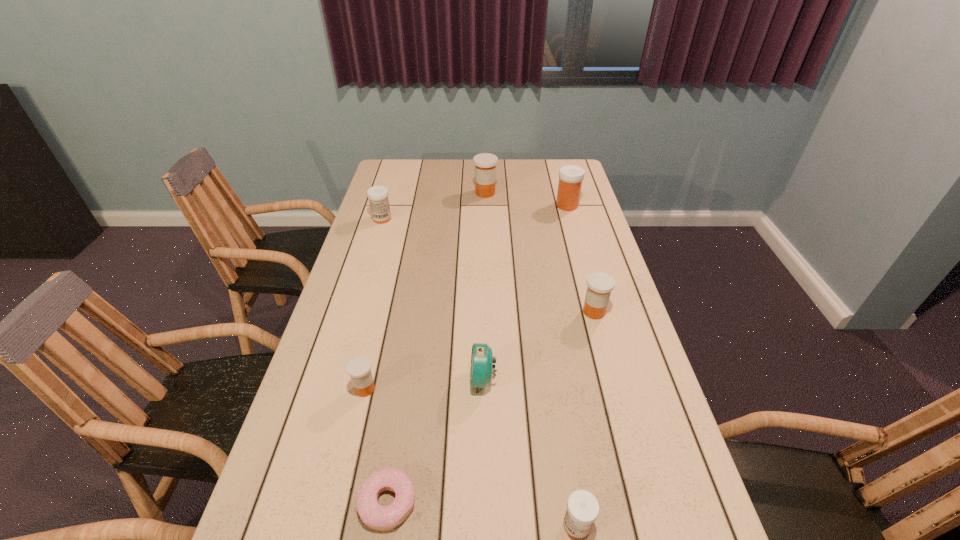
In order to click on vacant space located on the front-facing side of the blue alarm clock in this screenshot , I will do `click(438, 380)`.

The width and height of the screenshot is (960, 540). Find the location of `free location located on the front-facing side of the blue alarm clock`. free location located on the front-facing side of the blue alarm clock is located at coordinates (445, 380).

Find the location of a particular element. This screenshot has height=540, width=960. free spot located on the label of the second medicine from left to right is located at coordinates coord(474,389).

Locate an element on the screen. The height and width of the screenshot is (540, 960). vacant space located on the left of the third object from left to right is located at coordinates (310, 502).

You are a GUI agent. You are given a task and a screenshot of the screen. Output one action in this format:
    pyautogui.click(x=<x>, y=<y>)
    Task: Click on the blank space at the far edge
    Image resolution: width=960 pixels, height=540 pixels.
    Given the screenshot: What is the action you would take?
    pyautogui.click(x=441, y=164)

Image resolution: width=960 pixels, height=540 pixels. In the image, there is a desktop. In order to click on free space at the left edge in this screenshot , I will do `click(358, 433)`.

Where is `vacant space at the right edge of the desktop`? vacant space at the right edge of the desktop is located at coordinates tap(576, 256).

What are the coordinates of `free location at the far left corner` in the screenshot? It's located at (407, 171).

Identify the location of vacant region at the far right corner of the desktop. The image size is (960, 540). (564, 160).

This screenshot has width=960, height=540. I want to click on unoccupied area between the third farthest medicine and the shortest object, so click(385, 360).